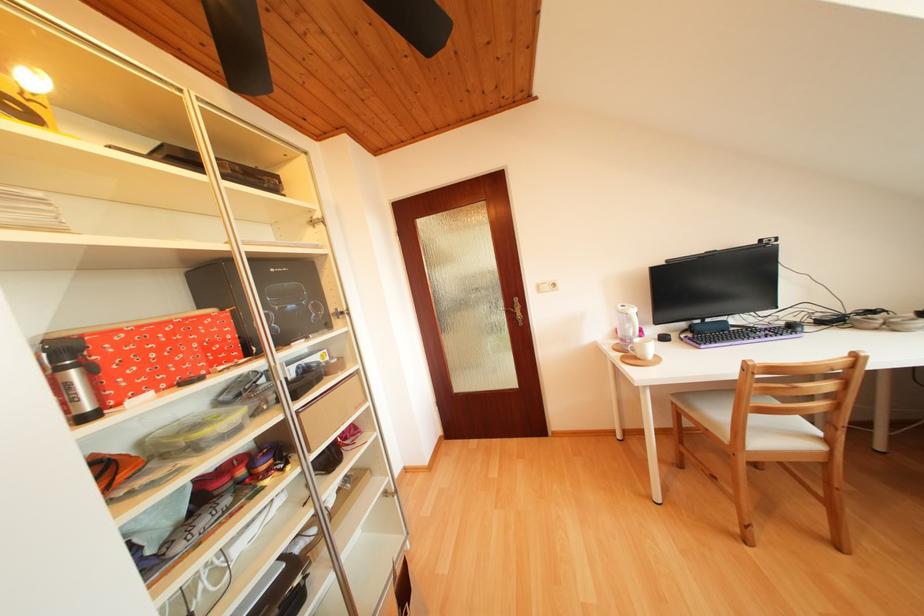
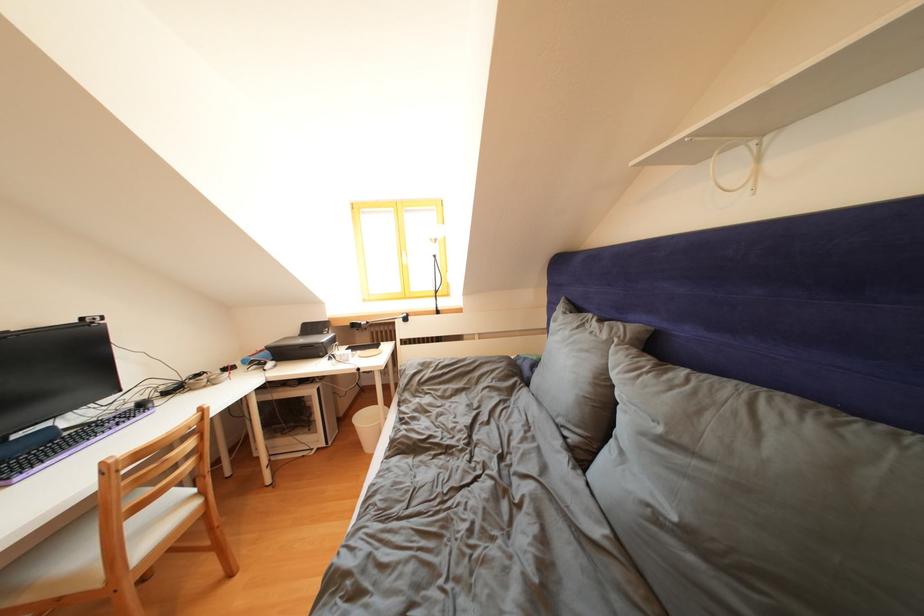
Question: The first image is from the beginning of the video and the second image is from the end. How did the camera likely rotate when shooting the video?

Choices:
 (A) Left
 (B) Right
 (C) Up
 (D) Down

Answer: (B)